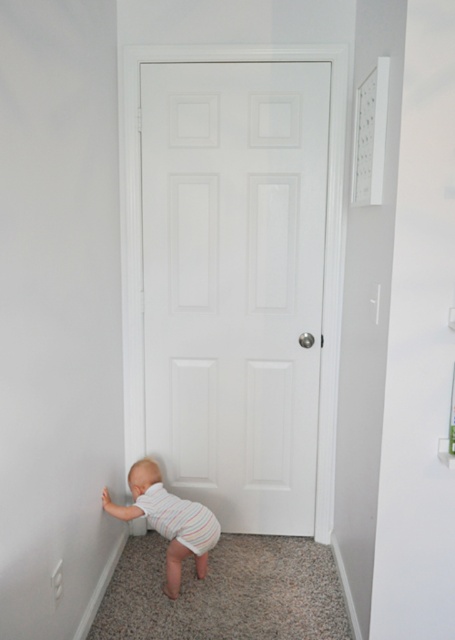
Consider the image. Does white matte door at center have a greater height compared to striped cotton onesie at lower left?

Yes.

Does white matte door at center have a lesser width compared to striped cotton onesie at lower left?

No.

Which is in front, point (317, 92) or point (156, 467)?

Point (317, 92) is more forward.

Locate an element on the screen. white matte door at center is located at coordinates (234, 284).

Is point (261, 193) positioned before point (171, 509)?

No, (261, 193) is behind (171, 509).

Is the position of white matte door at center more distant than that of striped cotton diaper at lower left?

Yes.

The height and width of the screenshot is (640, 455). Find the location of `white matte door at center`. white matte door at center is located at coordinates pyautogui.click(x=234, y=284).

Does striped cotton onesie at lower left have a lesser width compared to striped cotton diaper at lower left?

No.

Does point (161, 483) come in front of point (167, 534)?

No, (161, 483) is behind (167, 534).

Is point (155, 490) behind point (212, 547)?

No, it is not.

Image resolution: width=455 pixels, height=640 pixels. Find the location of `striped cotton onesie at lower left`. striped cotton onesie at lower left is located at coordinates (168, 520).